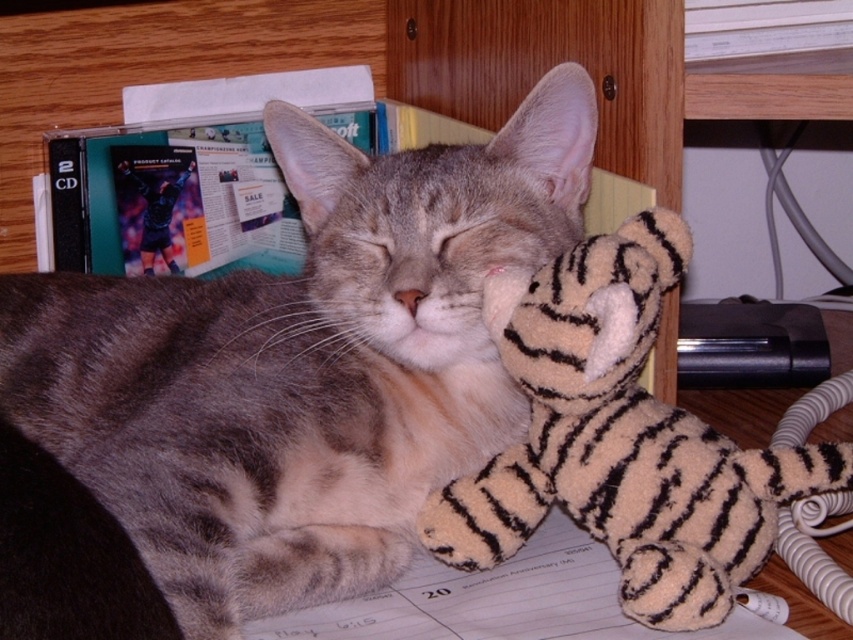
You are a veterinarian examining an image of a cat and a toy. In the image, the gray striped fur cat at center and the fuzzy beige tiger at center are shown. Which object is physically covering the other?

The gray striped fur cat at center is positioned over the fuzzy beige tiger at center, meaning the cat is physically covering the toy.

You are a pet owner who wants to place a new small water bowl between the gray striped fur cat at center and the fuzzy beige tiger at center. The bowl has a diameter of 6 inches. Will there be enough space between them to fit the bowl?

The gray striped fur cat at center and the fuzzy beige tiger at center are 7.93 inches apart. Since the bowl requires 6 inches of space, there is enough room to place it between them.

Based on the coordinates provided, which object is located at point (279, 385) in the image?

The gray striped fur cat at center is located at point (279, 385) in the image.